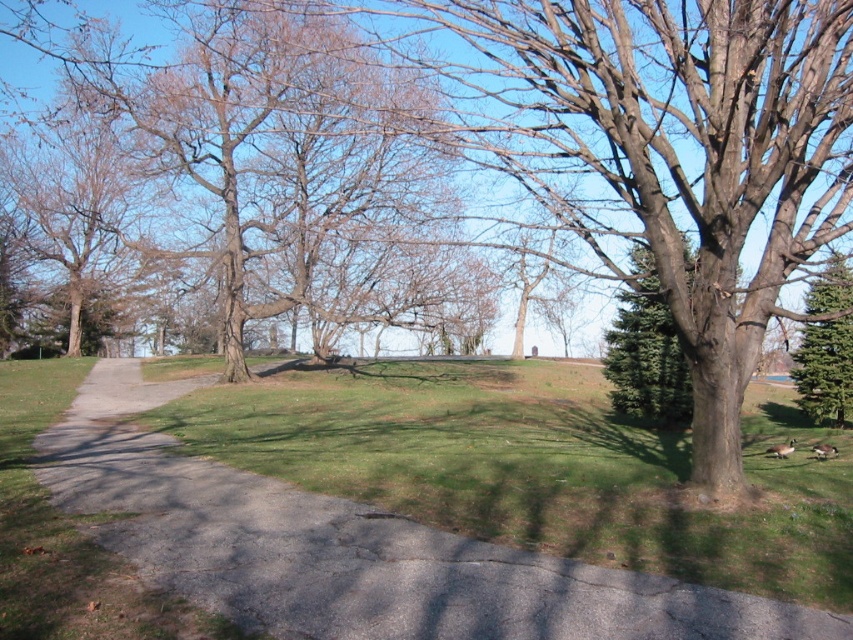
You are a gardener who needs to mow the gray asphalt path at center and trim the green textured evergreen tree at right. Which task should you do first if you want to start with the wider area?

The gray asphalt path at center might be wider than green textured evergreen tree at right, so you should mow the gray asphalt path at center first since it is wider.

From the picture: You are standing on the paved pathway in the park and see the green textured evergreen at right and the green textured evergreen tree at right. Which one is closer to you?

The green textured evergreen at right is closer to you because it is in front of the green textured evergreen tree at right.